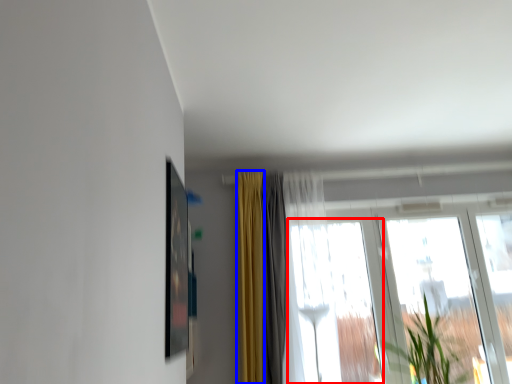
Question: Which of the following is the closest to the observer, window (highlighted by a red box) or curtain (highlighted by a blue box)?

Choices:
 (A) window
 (B) curtain

Answer: (A)